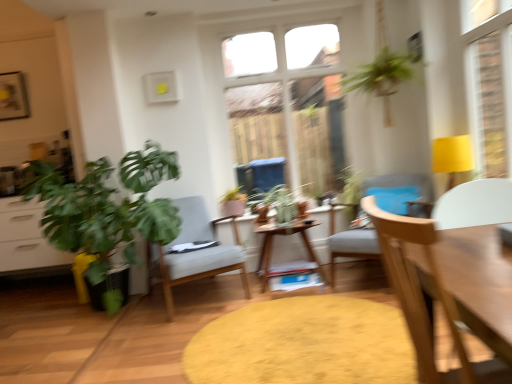
Question: In the image, is white matte chair at right, placed as the 2th chair when sorted from left to right, positioned in front of or behind light gray fabric chair at center, which appears as the third chair when viewed from the right?

Choices:
 (A) front
 (B) behind

Answer: (A)

Question: From the image's perspective, is white matte chair at right, the third chair positioned from the back, positioned above or below light gray fabric chair at center, which appears as the third chair when viewed from the right?

Choices:
 (A) above
 (B) below

Answer: (A)

Question: Which of these objects is positioned farthest from the white matte chair at right, arranged as the second chair when viewed from the right?

Choices:
 (A) matte pink pot at center, which is the first houseplant from right to left
 (B) light gray fabric chair at center, which appears as the third chair when viewed from the right
 (C) wooden table at center
 (D) wooden textured table at center
 (E) light gray fabric chair at center, the 2th chair positioned from the back

Answer: (A)

Question: Estimate the real-world distances between objects in this image. Which object is closer to the matte pink pot at center, which is the 2th houseplant from front to back?

Choices:
 (A) light gray fabric chair at center, the 2th chair positioned from the back
 (B) white matte chair at right, arranged as the second chair when viewed from the right
 (C) wooden textured table at center
 (D) white glass window at center
 (E) light gray fabric chair at center, marked as the 1th chair in a back-to-front arrangement

Answer: (E)